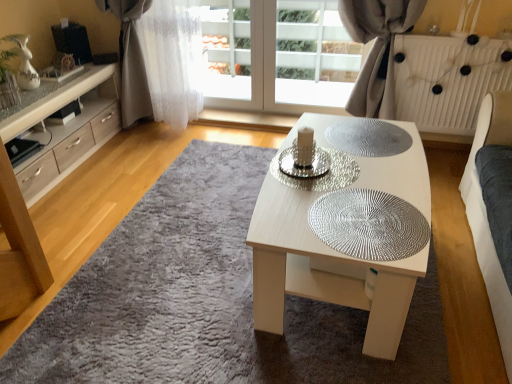
You are a GUI agent. You are given a task and a screenshot of the screen. Output one action in this format:
    pyautogui.click(x=<x>, y=<y>)
    Task: Click on the free location above silver textured glass plate at center, the first glass plate when ordered from front to back (from a real-world perspective)
    
    Given the screenshot: What is the action you would take?
    pyautogui.click(x=362, y=215)